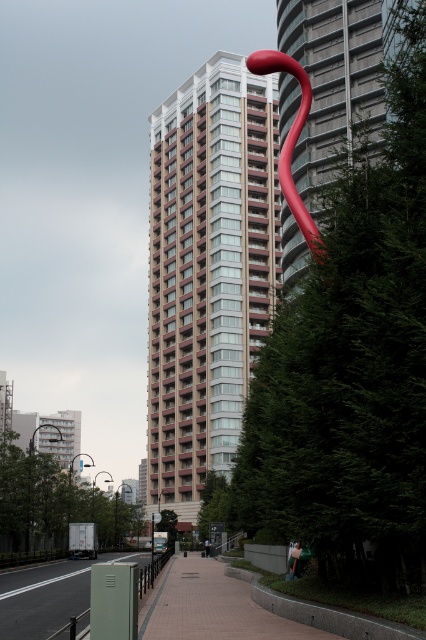
Is point (293, 632) positioned behind point (69, 564)?

No, (293, 632) is in front of (69, 564).

Can you confirm if tiled pavement at center is positioned above green matte pavement at lower left?

Indeed, tiled pavement at center is positioned over green matte pavement at lower left.

This screenshot has width=426, height=640. What do you see at coordinates (210, 608) in the screenshot? I see `tiled pavement at center` at bounding box center [210, 608].

Where is `tiled pavement at center`? Image resolution: width=426 pixels, height=640 pixels. tiled pavement at center is located at coordinates (210, 608).

Can you confirm if tiled pavement at center is positioned above rubber-like red sculpture at upper center?

No, tiled pavement at center is not above rubber-like red sculpture at upper center.

Which is above, tiled pavement at center or rubber-like red sculpture at upper center?

rubber-like red sculpture at upper center is above.

What do you see at coordinates (210, 608) in the screenshot?
I see `tiled pavement at center` at bounding box center [210, 608].

Find the location of `tiled pavement at center`. tiled pavement at center is located at coordinates (210, 608).

Who is positioned more to the right, green matte pavement at lower left or rubber-like red sculpture at upper center?

From the viewer's perspective, rubber-like red sculpture at upper center appears more on the right side.

Where is `green matte pavement at lower left`? This screenshot has width=426, height=640. green matte pavement at lower left is located at coordinates (48, 595).

Locate an element on the screen. green matte pavement at lower left is located at coordinates (48, 595).